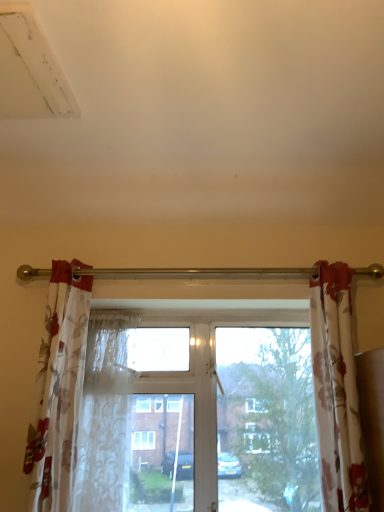
Question: Is floral fabric curtain at right, the 2th curtain when ordered from left to right, inside floral sheer curtain at left, marked as the first curtain in a left-to-right arrangement?

Choices:
 (A) no
 (B) yes

Answer: (A)

Question: Is floral sheer curtain at left, the second curtain in the right-to-left sequence, taller than floral fabric curtain at right, the 2th curtain when ordered from left to right?

Choices:
 (A) no
 (B) yes

Answer: (B)

Question: From the image's perspective, is floral sheer curtain at left, marked as the first curtain in a left-to-right arrangement, located above floral fabric curtain at right, the 2th curtain when ordered from left to right?

Choices:
 (A) yes
 (B) no

Answer: (B)

Question: Is floral sheer curtain at left, marked as the first curtain in a left-to-right arrangement, smaller than floral fabric curtain at right, which is the 1th curtain in right-to-left order?

Choices:
 (A) yes
 (B) no

Answer: (B)

Question: Is floral sheer curtain at left, the second curtain in the right-to-left sequence, to the left of floral fabric curtain at right, which is the 1th curtain in right-to-left order, from the viewer's perspective?

Choices:
 (A) yes
 (B) no

Answer: (A)

Question: Is point pyautogui.click(x=74, y=260) closer or farther from the camera than point pyautogui.click(x=87, y=504)?

Choices:
 (A) closer
 (B) farther

Answer: (B)

Question: From the image's perspective, is floral sheer curtain at left, the second curtain in the right-to-left sequence, located above or below translucent floral fabric at center?

Choices:
 (A) below
 (B) above

Answer: (B)

Question: Looking at their shapes, would you say floral sheer curtain at left, the second curtain in the right-to-left sequence, is wider or thinner than translucent floral fabric at center?

Choices:
 (A) thin
 (B) wide

Answer: (B)

Question: From a real-world perspective, is floral sheer curtain at left, the second curtain in the right-to-left sequence, positioned above or below translucent floral fabric at center?

Choices:
 (A) below
 (B) above

Answer: (B)

Question: Considering the positions of transparent glass window at center and floral fabric curtain at right, which is the 1th curtain in right-to-left order, in the image, is transparent glass window at center wider or thinner than floral fabric curtain at right, which is the 1th curtain in right-to-left order,?

Choices:
 (A) thin
 (B) wide

Answer: (A)

Question: Is transparent glass window at center inside or outside of floral fabric curtain at right, the 2th curtain when ordered from left to right?

Choices:
 (A) outside
 (B) inside

Answer: (A)

Question: Based on their positions, is transparent glass window at center located to the left or right of floral fabric curtain at right, which is the 1th curtain in right-to-left order?

Choices:
 (A) right
 (B) left

Answer: (B)

Question: Is point click(x=180, y=438) closer or farther from the camera than point click(x=311, y=343)?

Choices:
 (A) closer
 (B) farther

Answer: (B)

Question: In terms of height, does translucent floral fabric at center look taller or shorter compared to transparent glass window at center?

Choices:
 (A) short
 (B) tall

Answer: (A)

Question: Is point (109, 473) positioned closer to the camera than point (41, 403)?

Choices:
 (A) farther
 (B) closer

Answer: (A)